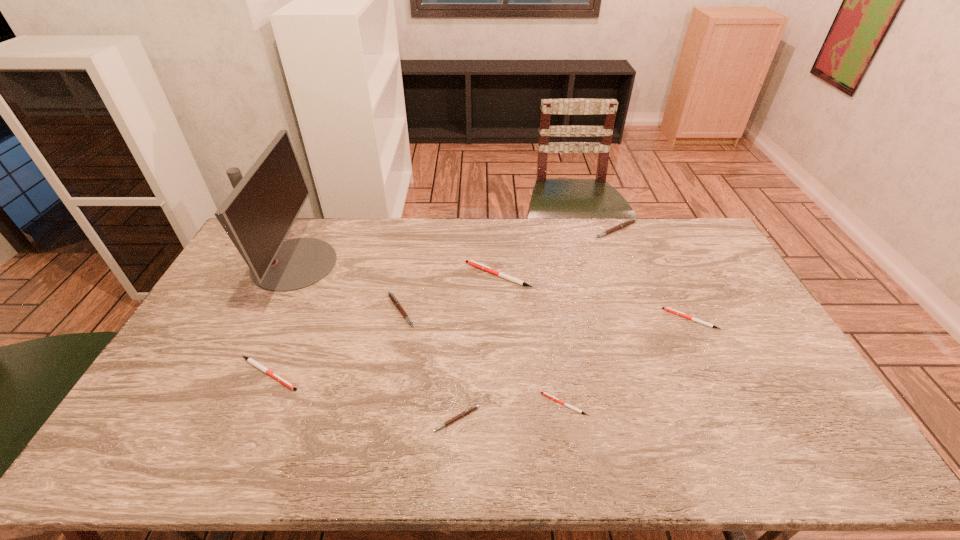
The height and width of the screenshot is (540, 960). I want to click on vacant space that's between the second pink pen from right to left and the gray computer monitor, so click(375, 341).

This screenshot has width=960, height=540. What are the coordinates of `unoccupied position between the second pink pen from left to right and the shortest pen` in the screenshot? It's located at (511, 411).

Where is `vacant point located between the leftmost white pen and the gray computer monitor`? vacant point located between the leftmost white pen and the gray computer monitor is located at coordinates (281, 319).

I want to click on empty location between the gray computer monitor and the nearest white pen, so click(429, 334).

The height and width of the screenshot is (540, 960). What are the coordinates of `empty location between the nearest pink pen and the shortest pen` in the screenshot? It's located at (511, 411).

At what (x,y) coordinates should I click in order to perform the action: click on free spot between the leftmost pink pen and the shortest pen. Please return your answer as a coordinate pair (x, y). This screenshot has width=960, height=540. Looking at the image, I should click on (482, 357).

This screenshot has width=960, height=540. In order to click on blank region between the smallest white pen and the farthest white pen in this screenshot , I will do `click(531, 340)`.

Identify the location of unoccupied area between the second nearest white pen and the rightmost white pen. (480, 346).

This screenshot has height=540, width=960. I want to click on empty location between the second biggest white pen and the second nearest pink pen, so click(x=335, y=342).

Locate which object ranks sixth in proximity to the farthest pen. Please provide its 2D coordinates. Your answer should be formatted as a tuple, i.e. [(x, y)], where the tuple contains the x and y coordinates of a point satisfying the conditions above.

[(258, 214)]